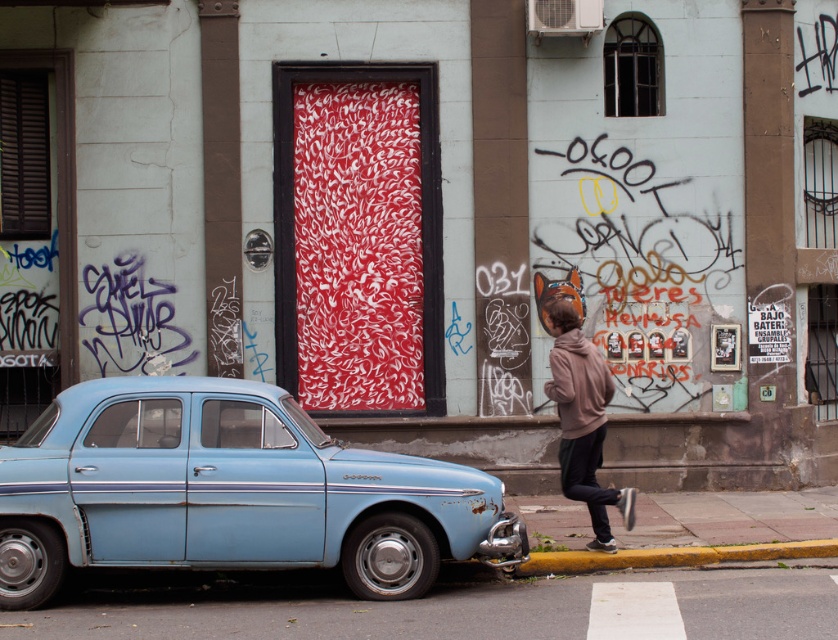
You are a pedestrian standing on the sidewalk and want to walk from point A to point B. The points are labeled as point [480,481] and point [578,465]. Which point should you start at to walk towards the building?

You should start at point [578,465] and walk towards point [480,481] because point [480,481] is in front of point [578,465], meaning it is closer to the building.